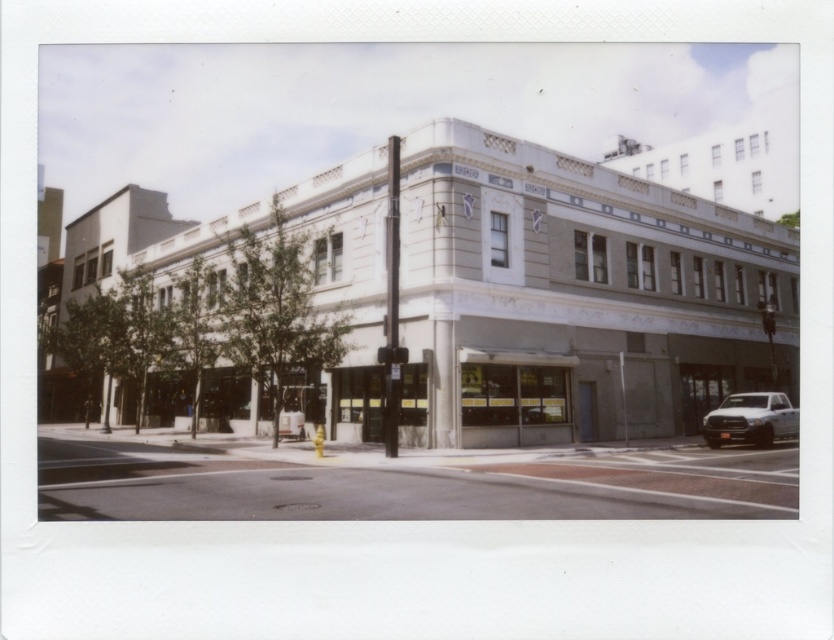
Does concrete sidewalk at lower center lie behind white matte truck at lower right?

That is False.

Is point (455, 490) more distant than point (770, 413)?

No, it is not.

Identify the location of concrete sidewalk at lower center. (409, 484).

Locate an element on the screen. The image size is (834, 640). concrete sidewalk at lower center is located at coordinates (409, 484).